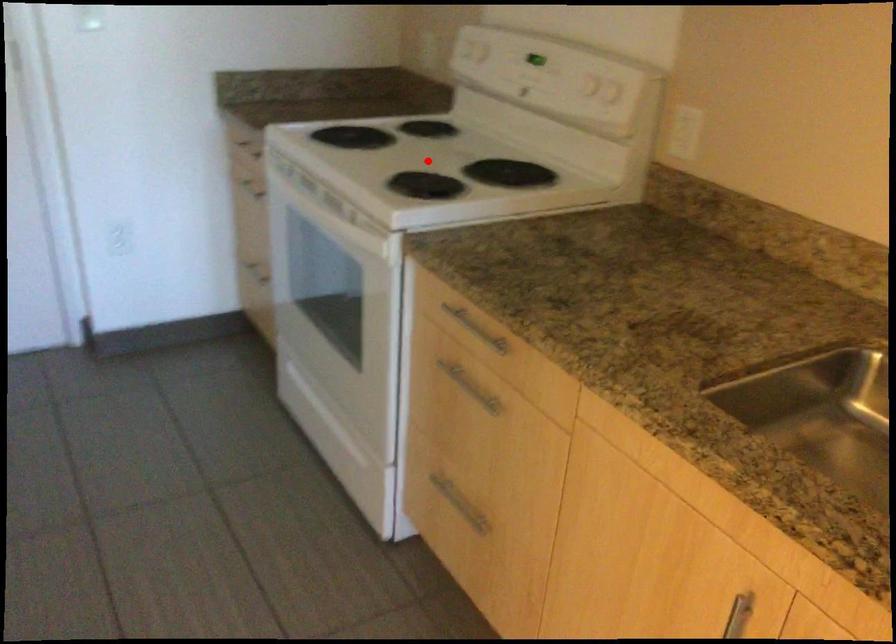
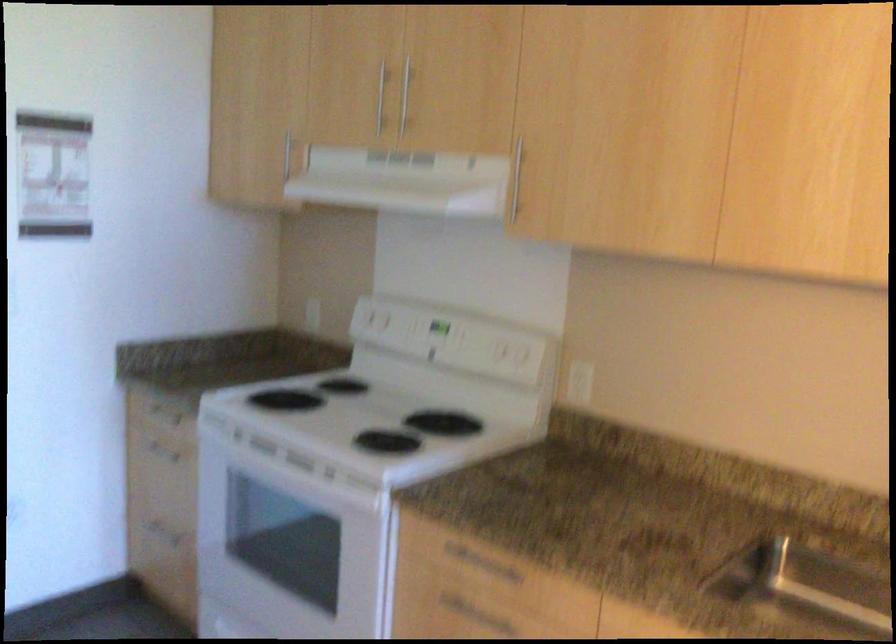
Question: A red point is marked in image1. In image2, is the corresponding 3D point closer to the camera or farther? Reply with the corresponding letter.

Choices:
 (A) The corresponding 3D point is closer.
 (B) The corresponding 3D point is farther.

Answer: (B)